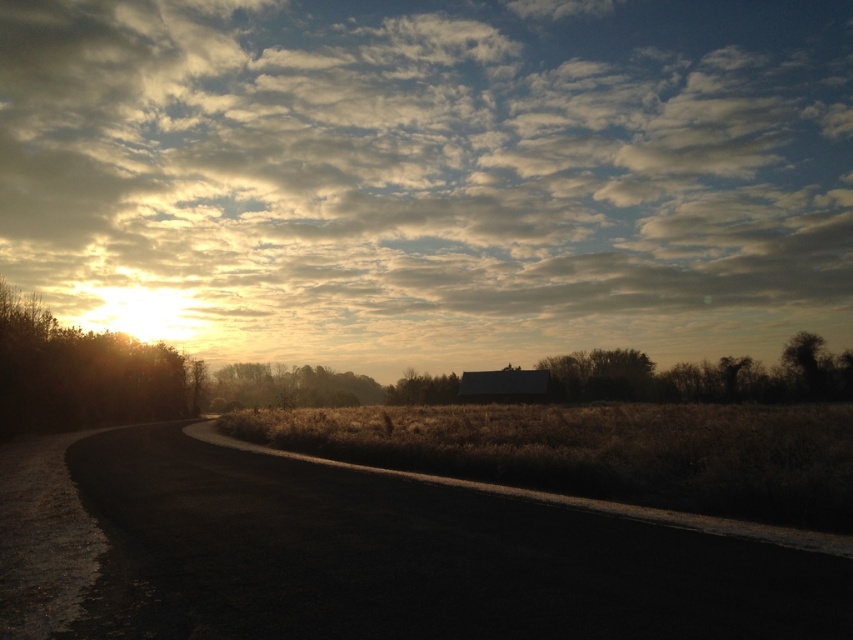
Question: Which point is farther to the camera?

Choices:
 (A) brown grass at center
 (B) brown matte tree at center

Answer: (B)

Question: Which is nearer to the brown grass at center?

Choices:
 (A) brown matte tree at center
 (B) golden brown foliage at left

Answer: (B)

Question: Does cloudy sky at upper center lie behind brown grass at center?

Choices:
 (A) no
 (B) yes

Answer: (B)

Question: Is cloudy sky at upper center positioned before brown grass at center?

Choices:
 (A) yes
 (B) no

Answer: (B)

Question: Which object appears farthest from the camera in this image?

Choices:
 (A) cloudy sky at upper center
 (B) brown matte tree at center
 (C) brown grass at center

Answer: (A)

Question: Is cloudy sky at upper center thinner than brown grass at center?

Choices:
 (A) yes
 (B) no

Answer: (B)